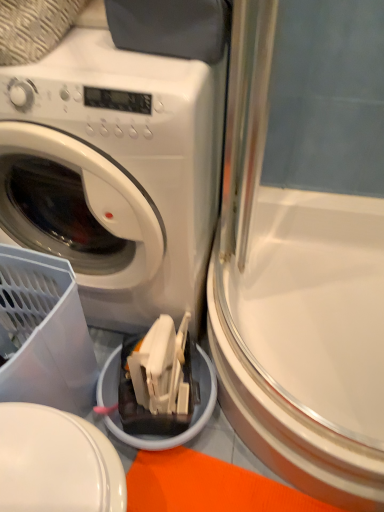
Question: Considering the positions of white glossy washing machine at upper left and white glossy screen door at lower right in the image, is white glossy washing machine at upper left bigger or smaller than white glossy screen door at lower right?

Choices:
 (A) small
 (B) big

Answer: (B)

Question: Is white glossy washing machine at upper left in front of or behind white glossy screen door at lower right in the image?

Choices:
 (A) behind
 (B) front

Answer: (B)

Question: Choose the correct answer: Is white glossy washing machine at upper left inside white glossy screen door at lower right or outside it?

Choices:
 (A) outside
 (B) inside

Answer: (A)

Question: Relative to white glossy washing machine at upper left, is white glossy screen door at lower right in front or behind?

Choices:
 (A) front
 (B) behind

Answer: (B)

Question: Based on their positions, is white glossy screen door at lower right located to the left or right of white glossy washing machine at upper left?

Choices:
 (A) left
 (B) right

Answer: (B)

Question: In terms of height, does white glossy screen door at lower right look taller or shorter compared to white glossy washing machine at upper left?

Choices:
 (A) tall
 (B) short

Answer: (B)

Question: Looking at their shapes, would you say white glossy screen door at lower right is wider or thinner than white glossy washing machine at upper left?

Choices:
 (A) wide
 (B) thin

Answer: (A)